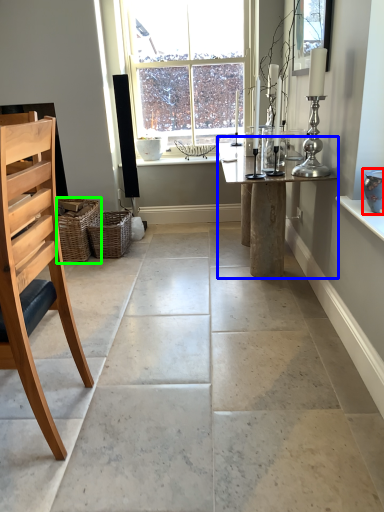
Question: Which object is the closest to the vase (highlighted by a red box)? Choose among these: table (highlighted by a blue box) or basket (highlighted by a green box).

Choices:
 (A) table
 (B) basket

Answer: (A)